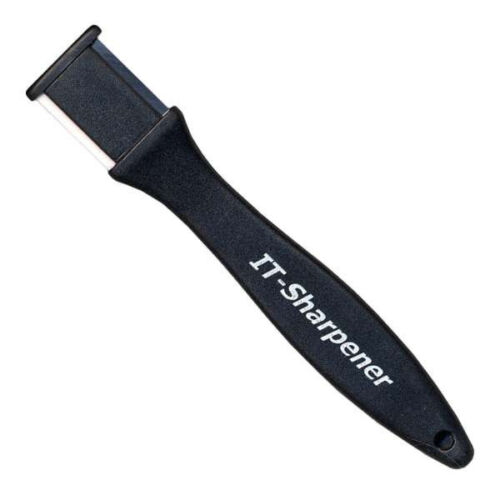
The image size is (500, 500). In order to click on top of the sharpener in this screenshot , I will do `click(361, 302)`.